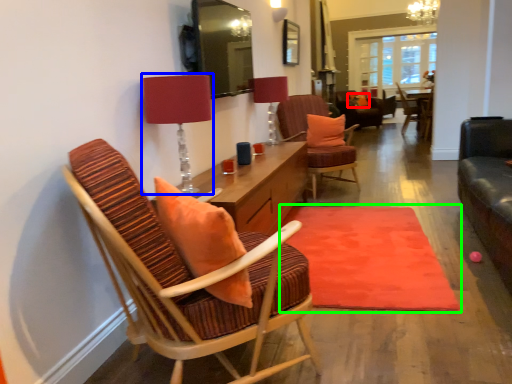
Question: Estimate the real-world distances between objects in this image. Which object is closer to pillow (highlighted by a red box), table lamp (highlighted by a blue box) or mat (highlighted by a green box)?

Choices:
 (A) table lamp
 (B) mat

Answer: (B)